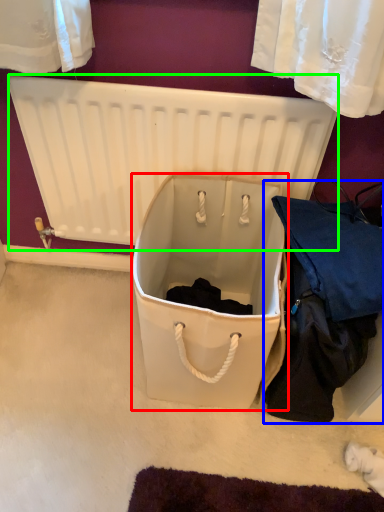
Question: Which object is the closest to the storage box (highlighted by a red box)? Choose among these: clothing (highlighted by a blue box) or radiator (highlighted by a green box).

Choices:
 (A) clothing
 (B) radiator

Answer: (A)